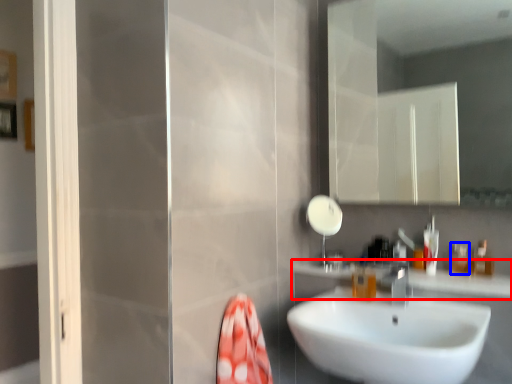
Question: Which point is closer to the camera, counter top (highlighted by a red box) or toiletry (highlighted by a blue box)?

Choices:
 (A) counter top
 (B) toiletry

Answer: (A)